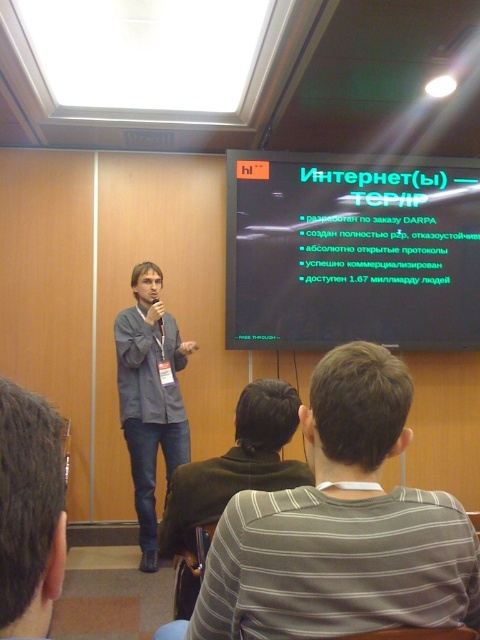
You are an attendee at the presentation. You want to take a photo of the green matte projection screen at upper center and the denim jeans at center. Which object should you zoom in more on to capture both in the frame?

You should zoom in more on the denim jeans at center because it is smaller than the green matte projection screen at upper center, allowing both to fit in the frame.

You are an attendee at this presentation. You notice a point marked at coordinates (29, 512). What is located at that point?

The point at coordinates (29, 512) is located on the dark brown hair at upper center.